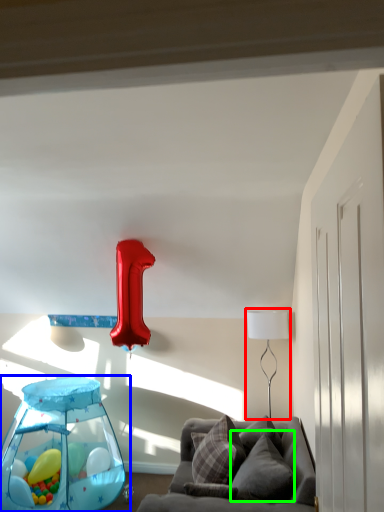
Question: Based on their relative distances, which object is farther from table lamp (highlighted by a red box)? Choose from baby carriage (highlighted by a blue box) and pillow (highlighted by a green box).

Choices:
 (A) baby carriage
 (B) pillow

Answer: (A)